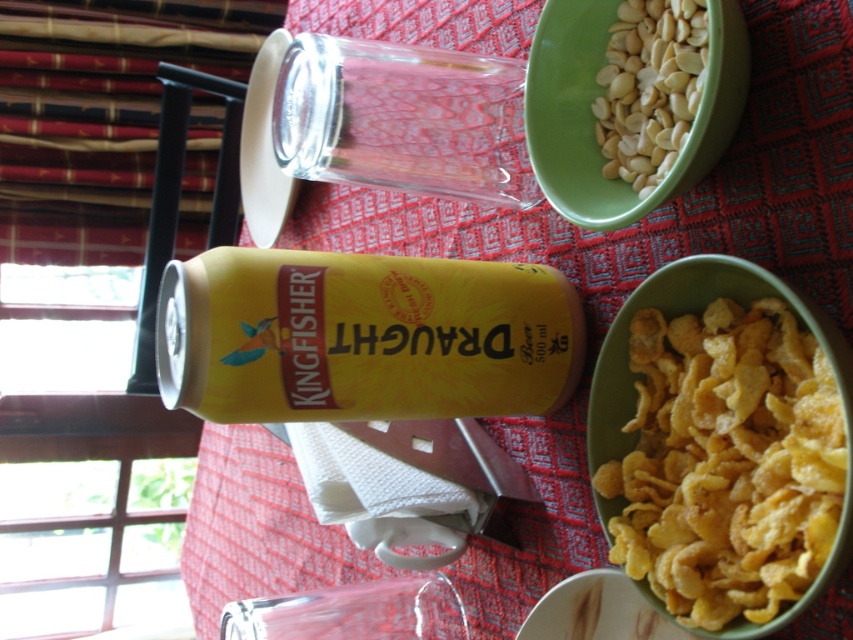
Is green plastic bowl at upper right to the right of white matte peanuts at upper right from the viewer's perspective?

No, green plastic bowl at upper right is not to the right of white matte peanuts at upper right.

From the picture: Which is below, green plastic bowl at upper right or white matte peanuts at upper right?

Positioned lower is green plastic bowl at upper right.

Does point (544, 168) come farther from viewer compared to point (669, 42)?

Yes.

You are a GUI agent. You are given a task and a screenshot of the screen. Output one action in this format:
    pyautogui.click(x=<x>, y=<y>)
    Task: Click on the green plastic bowl at upper right
    
    Given the screenshot: What is the action you would take?
    pyautogui.click(x=590, y=115)

Is yellow crispy cereal at lower right above white matte peanuts at upper right?

No.

Who is more forward, (639, 381) or (593, 113)?

Positioned in front is point (639, 381).

Between point (650, 424) and point (656, 72), which one is positioned in front?

Point (650, 424) is in front.

The image size is (853, 640). What are the coordinates of `yellow crispy cereal at lower right` in the screenshot? It's located at (727, 461).

Who is more forward, (x=350, y=365) or (x=610, y=58)?

Point (x=350, y=365)

What do you see at coordinates (363, 337) in the screenshot? This screenshot has height=640, width=853. I see `yellow matte can at center` at bounding box center [363, 337].

Locate an element on the screen. The width and height of the screenshot is (853, 640). yellow matte can at center is located at coordinates (363, 337).